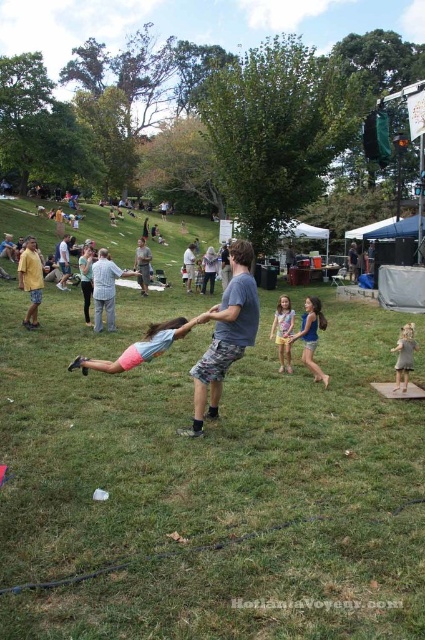
You are standing at the origin point of the coordinate system in the park scene. A gray camouflage shorts at center is located at point (x=142, y=264). If you want to walk towards the gray camouflage shorts at center, which direction should you move relative to your current position?

To reach the gray camouflage shorts at center located at point (x=142, y=264), you should move towards the coordinates specified, which would be the direction corresponding to those coordinates from your current position at the origin.

You are a photographer at the park and want to capture a photo of both the blue denim shorts at center and the multicolored fabric dress at center in the same frame. Given that your camera has a minimum focus distance of 20 inches, will you be able to take the photo without moving closer?

The distance between the blue denim shorts at center and the multicolored fabric dress at center is 21.68 inches, which is greater than the minimum focus distance of 20 inches. Therefore, you can take the photo without moving closer.